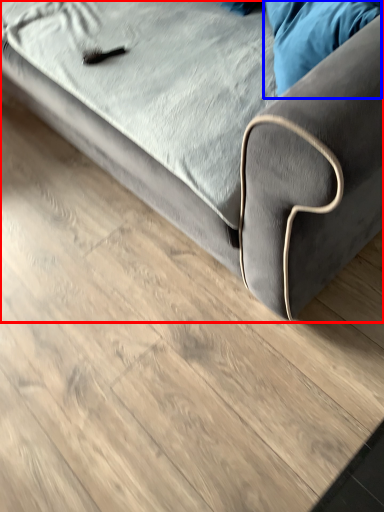
Question: Which of the following is the farthest to the observer, studio couch (highlighted by a red box) or pillow (highlighted by a blue box)?

Choices:
 (A) studio couch
 (B) pillow

Answer: (B)